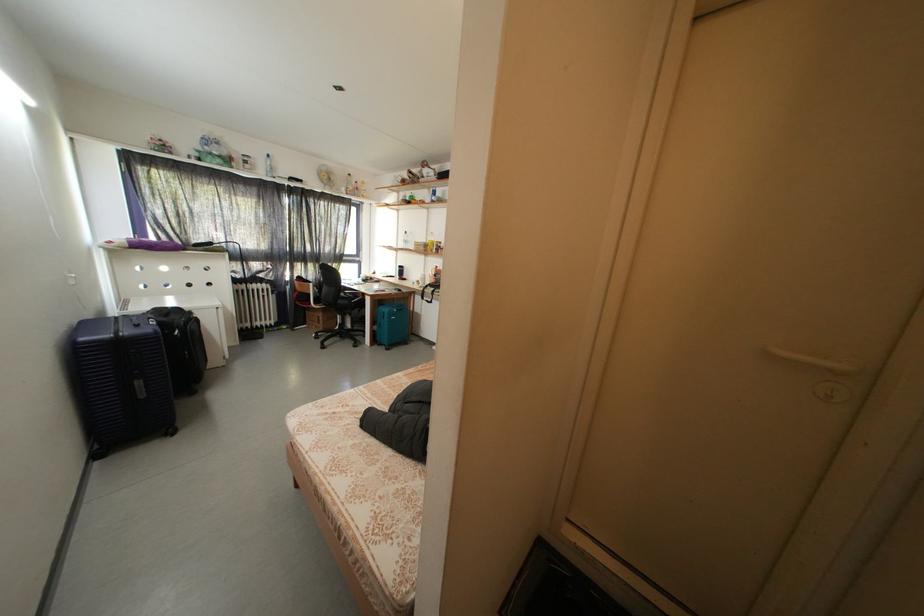
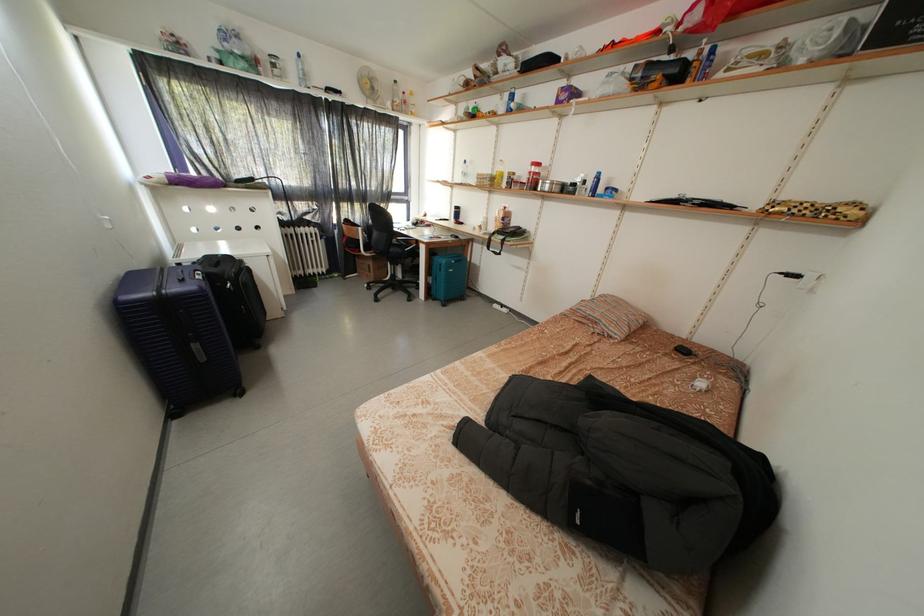
The point at [195,328] is marked in the first image. Where is the corresponding point in the second image?

(246, 280)